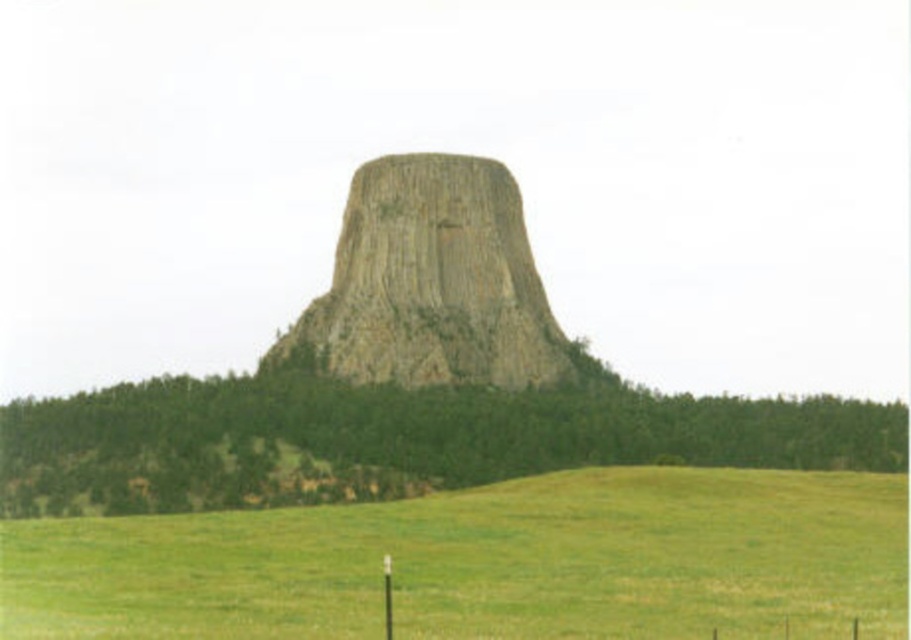
You are standing at the base of the Devils Tower and see the green grassy hill at center and the rusty stone rock formation at center. Which object is lower in elevation?

The green grassy hill at center is below the rusty stone rock formation at center, so the green grassy hill at center is lower in elevation.

You are standing at the base of Devils Tower and want to take a photo of the green grassy field at lower center and the green grassy hill at center. Which one should you focus on first if you want both to be in clear view?

You should focus on the green grassy hill at center first because the green grassy field at lower center is closer to the viewer, so adjusting focus from near to far will help both be in clear view.

Consider the image. You are a hiker planning to walk from the green grassy field at lower center to the green grassy hill at center. Considering the terrain differences, which area would require less effort to traverse?

The green grassy field at lower center would require less effort to traverse since it is shorter than the green grassy hill at center, making it easier to walk on.